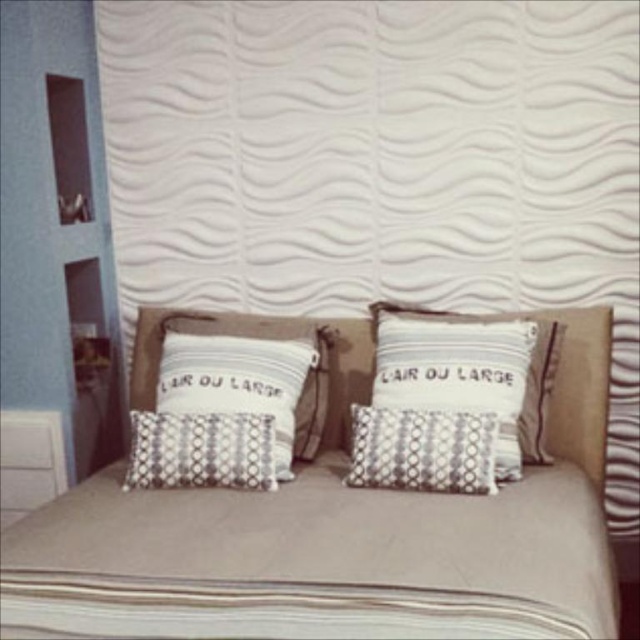
Question: In this image, where is beige fabric bed at center located relative to silver metallic pillow at center?

Choices:
 (A) left
 (B) right

Answer: (A)

Question: Which of the following is the closest to the observer?

Choices:
 (A) patterned fabric pillow at center
 (B) white textured wall panel at upper center

Answer: (A)

Question: Does beige fabric bed at center lie behind white textured pillow at center?

Choices:
 (A) yes
 (B) no

Answer: (B)

Question: Which point appears closest to the camera in this image?

Choices:
 (A) (465, 400)
 (B) (196, 442)
 (C) (200, 248)

Answer: (B)

Question: Which point is farther to the camera?

Choices:
 (A) (256, 454)
 (B) (392, 228)
 (C) (424, 486)

Answer: (B)

Question: Does white textured wall panel at upper center have a smaller size compared to beige fabric bed at center?

Choices:
 (A) yes
 (B) no

Answer: (B)